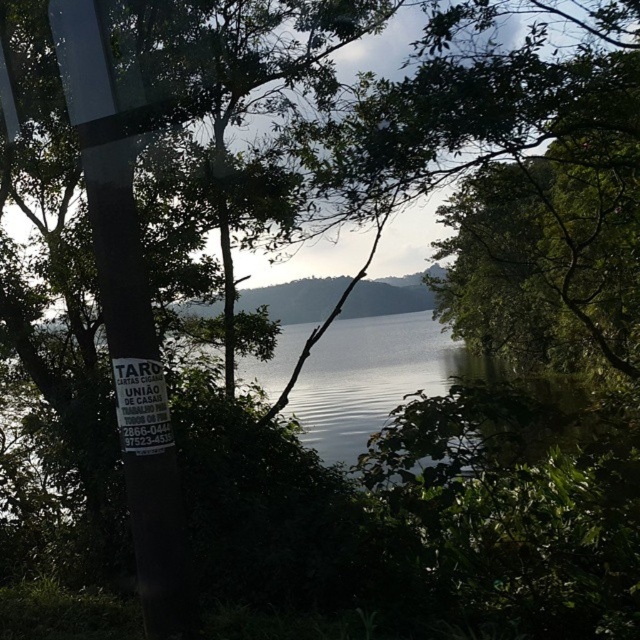
Question: Which of the following is the farthest from the observer?

Choices:
 (A) (99, 282)
 (B) (134, 419)

Answer: (A)

Question: Is black plastic pole at left behind white paper sign at left?

Choices:
 (A) no
 (B) yes

Answer: (B)

Question: Can you confirm if black plastic pole at left is thinner than white paper sign at left?

Choices:
 (A) yes
 (B) no

Answer: (B)

Question: Is black plastic pole at left positioned behind white paper sign at left?

Choices:
 (A) no
 (B) yes

Answer: (B)